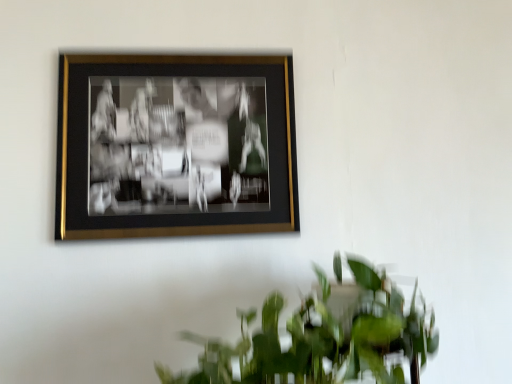
Describe the element at coordinates (175, 146) in the screenshot. I see `black/golden picture frame at upper center` at that location.

What is the approximate width of black/golden picture frame at upper center?

black/golden picture frame at upper center is 1.25 inches in width.

Locate an element on the screen. black/golden picture frame at upper center is located at coordinates (175, 146).

Where is `black/golden picture frame at upper center`? This screenshot has width=512, height=384. black/golden picture frame at upper center is located at coordinates (175, 146).